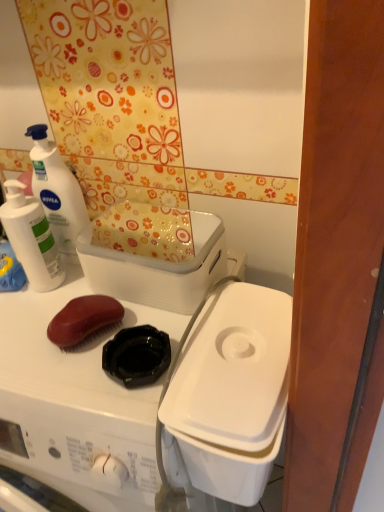
Question: From the image's perspective, is white matte lotion at upper left, which appears as the 1th cleaning product when viewed from the right, positioned above or below white plastic washing machine at upper left?

Choices:
 (A) above
 (B) below

Answer: (A)

Question: Is point (81, 207) positioned closer to the camera than point (145, 484)?

Choices:
 (A) closer
 (B) farther

Answer: (B)

Question: Based on their relative distances, which object is nearer to the white plastic container at center-right, the 1th appliance when ordered from bottom to top?

Choices:
 (A) white matte lotion at upper left, the second cleaning product viewed from the left
 (B) white plastic container at upper center, which is the 2th appliance in bottom-to-top order
 (C) white matte lotion at upper left, acting as the 2th cleaning product starting from the right
 (D) white plastic washing machine at upper left

Answer: (D)

Question: Which object is positioned closest to the white matte lotion at upper left, acting as the 2th cleaning product starting from the right?

Choices:
 (A) white plastic container at upper center, which is the 2th appliance in bottom-to-top order
 (B) white plastic washing machine at upper left
 (C) white matte lotion at upper left, which appears as the 1th cleaning product when viewed from the right
 (D) white plastic container at center-right, which is counted as the 2th appliance, starting from the top

Answer: (C)